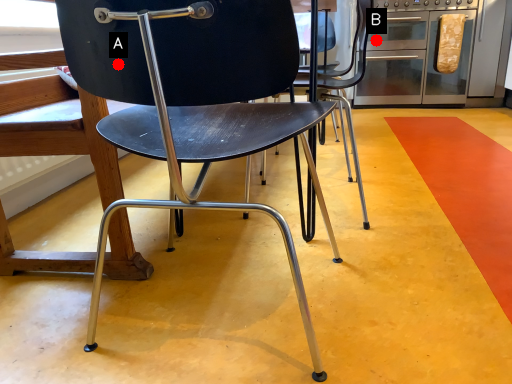
Question: Two points are circled on the image, labeled by A and B beside each circle. Among these points, which one is farthest from the camera?

Choices:
 (A) A is further
 (B) B is further

Answer: (B)